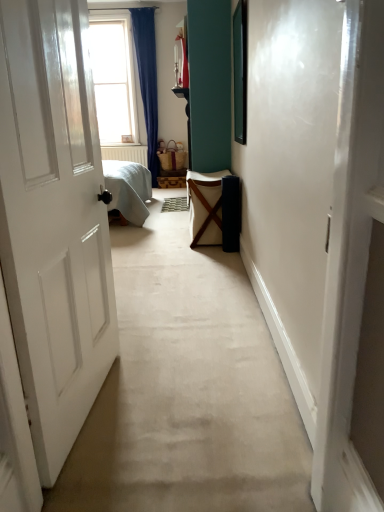
Question: Is clear glass window at upper left behind textured beige doormat at center?

Choices:
 (A) yes
 (B) no

Answer: (A)

Question: Is clear glass window at upper left turned away from textured beige doormat at center?

Choices:
 (A) yes
 (B) no

Answer: (B)

Question: From a real-world perspective, is clear glass window at upper left under textured beige doormat at center?

Choices:
 (A) no
 (B) yes

Answer: (A)

Question: Considering the relative sizes of clear glass window at upper left and textured beige doormat at center in the image provided, is clear glass window at upper left wider than textured beige doormat at center?

Choices:
 (A) no
 (B) yes

Answer: (A)

Question: Considering the relative sizes of clear glass window at upper left and textured beige doormat at center in the image provided, is clear glass window at upper left bigger than textured beige doormat at center?

Choices:
 (A) no
 (B) yes

Answer: (B)

Question: Is textured beige doormat at center inside clear glass window at upper left?

Choices:
 (A) no
 (B) yes

Answer: (A)

Question: Does clear glass window at upper left have a greater width compared to white canvas laundry basket at center?

Choices:
 (A) no
 (B) yes

Answer: (A)

Question: Can you confirm if clear glass window at upper left is positioned to the right of white canvas laundry basket at center?

Choices:
 (A) yes
 (B) no

Answer: (B)

Question: Can you confirm if clear glass window at upper left is smaller than white canvas laundry basket at center?

Choices:
 (A) yes
 (B) no

Answer: (B)

Question: Is clear glass window at upper left outside of white canvas laundry basket at center?

Choices:
 (A) yes
 (B) no

Answer: (A)

Question: Considering the relative sizes of clear glass window at upper left and white canvas laundry basket at center in the image provided, is clear glass window at upper left bigger than white canvas laundry basket at center?

Choices:
 (A) no
 (B) yes

Answer: (B)

Question: Is clear glass window at upper left positioned far away from white canvas laundry basket at center?

Choices:
 (A) yes
 (B) no

Answer: (A)

Question: Considering the relative sizes of textured beige doormat at center and white canvas laundry basket at center in the image provided, is textured beige doormat at center smaller than white canvas laundry basket at center?

Choices:
 (A) yes
 (B) no

Answer: (A)